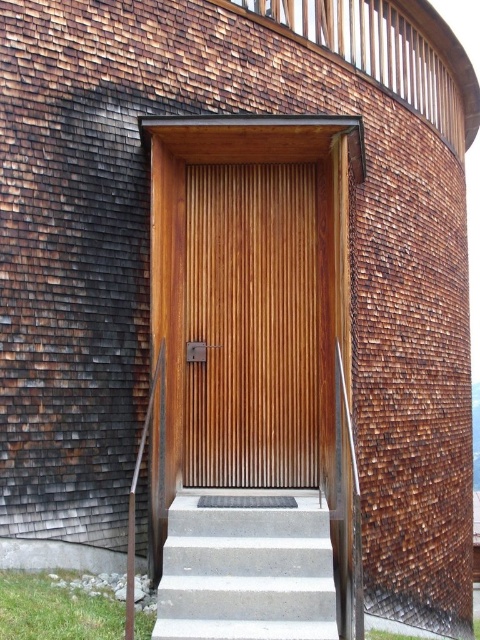
Question: Is wooden slats at center closer to camera compared to concrete stairs at center?

Choices:
 (A) yes
 (B) no

Answer: (B)

Question: Which of the following is the farthest from the observer?

Choices:
 (A) wooden slats at center
 (B) wooden textured rail at left

Answer: (A)

Question: Based on their relative distances, which object is farther from the concrete stairs at center?

Choices:
 (A) wooden textured rail at left
 (B) wooden slats at center

Answer: (B)

Question: Can you confirm if wooden slats at center is smaller than concrete stairs at center?

Choices:
 (A) yes
 (B) no

Answer: (B)

Question: Which object is farther from the camera taking this photo?

Choices:
 (A) concrete stairs at center
 (B) wooden textured rail at left

Answer: (B)

Question: Is wooden slats at center positioned behind concrete stairs at center?

Choices:
 (A) no
 (B) yes

Answer: (B)